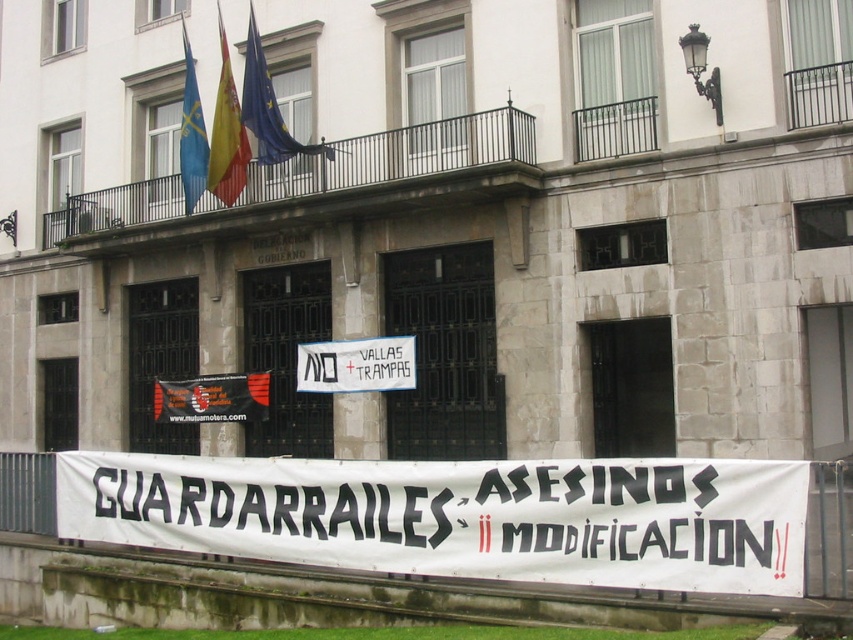
Question: Which object is positioned closest to the blue fabric flag at upper center?

Choices:
 (A) black fabric banner at lower center
 (B) blue fabric flag at upper left
 (C) white paper banner at lower center

Answer: (B)

Question: Is white paper banner at lower center wider than white paper sign at center?

Choices:
 (A) yes
 (B) no

Answer: (B)

Question: Which object appears farthest from the camera in this image?

Choices:
 (A) yellow fabric flag at upper center
 (B) white paper banner at lower center

Answer: (A)

Question: Is white paper sign at center to the left of black fabric banner at lower center from the viewer's perspective?

Choices:
 (A) yes
 (B) no

Answer: (B)

Question: Which of the following is the closest to the observer?

Choices:
 (A) (357, 339)
 (B) (180, 387)
 (C) (223, 52)
 (D) (199, 132)

Answer: (A)

Question: Is the position of white paper sign at center more distant than that of blue fabric flag at upper center?

Choices:
 (A) yes
 (B) no

Answer: (B)